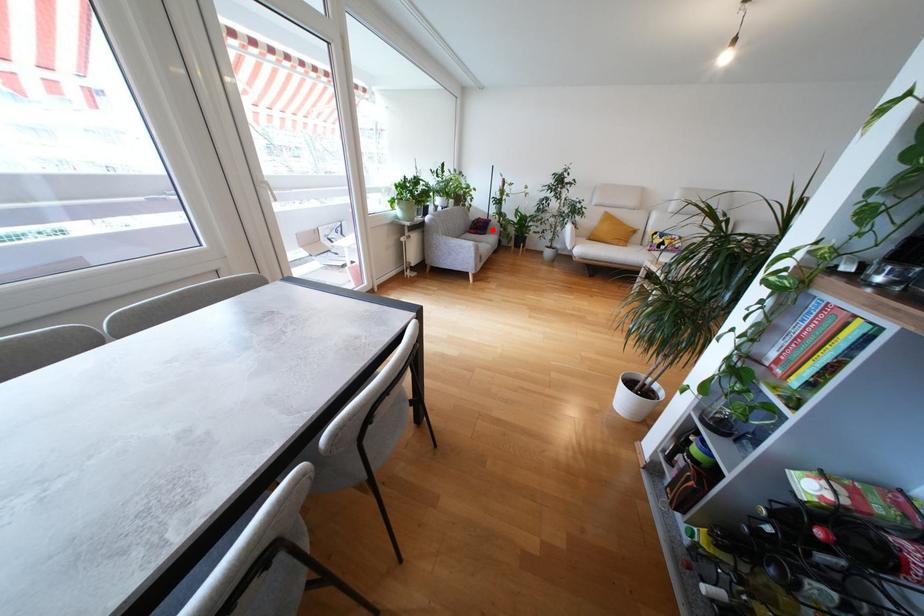
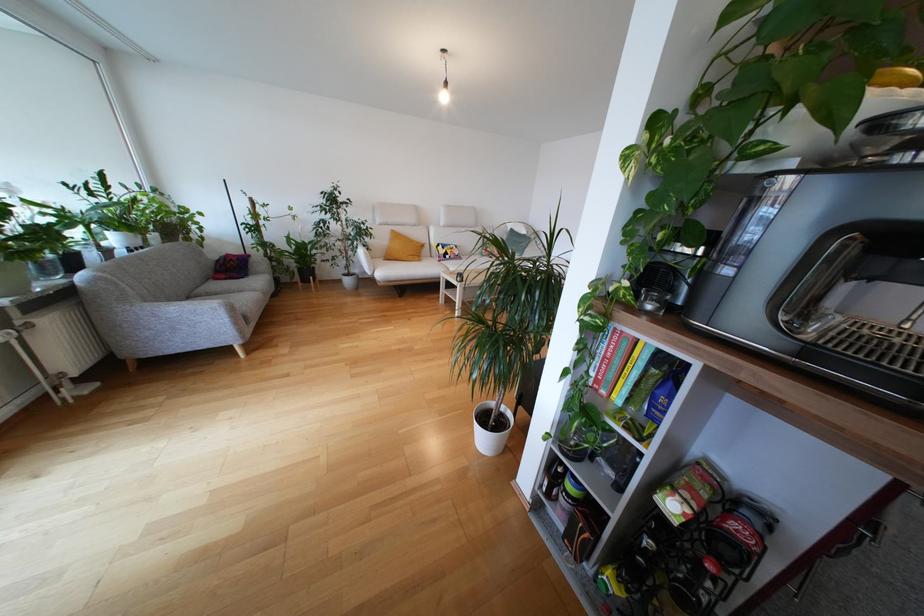
Question: I am providing you with two images of the same scene from different viewpoints. Given a red point in image1, look at the same physical point in image2. Is it:

Choices:
 (A) Closer to the viewpoint
 (B) Farther from the viewpoint

Answer: (A)